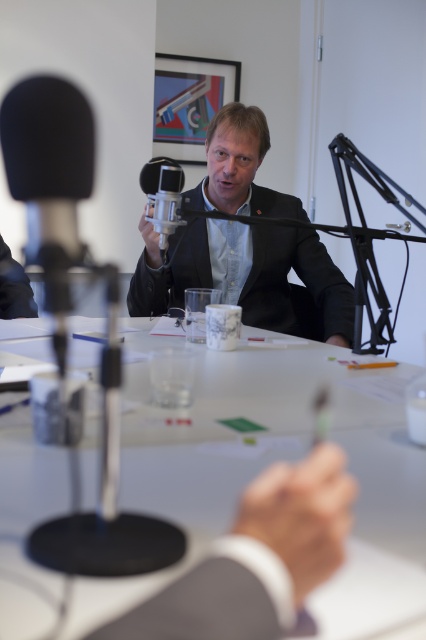
Question: Considering the real-world distances, which object is closest to the white glossy table at center?

Choices:
 (A) matte black suit at center
 (B) satin black microphone at center

Answer: (B)

Question: Which of the following is the closest to the observer?

Choices:
 (A) (138, 470)
 (B) (176, 196)
 (C) (154, 268)

Answer: (A)

Question: Where is white glossy table at center located in relation to satin black microphone at center in the image?

Choices:
 (A) below
 (B) above

Answer: (A)

Question: Estimate the real-world distances between objects in this image. Which object is farther from the matte black suit at center?

Choices:
 (A) white glossy table at center
 (B) satin black microphone at center

Answer: (A)

Question: Can you confirm if white glossy table at center is thinner than matte black suit at center?

Choices:
 (A) yes
 (B) no

Answer: (B)

Question: From the image, what is the correct spatial relationship of white glossy table at center in relation to matte black suit at center?

Choices:
 (A) above
 (B) below

Answer: (B)